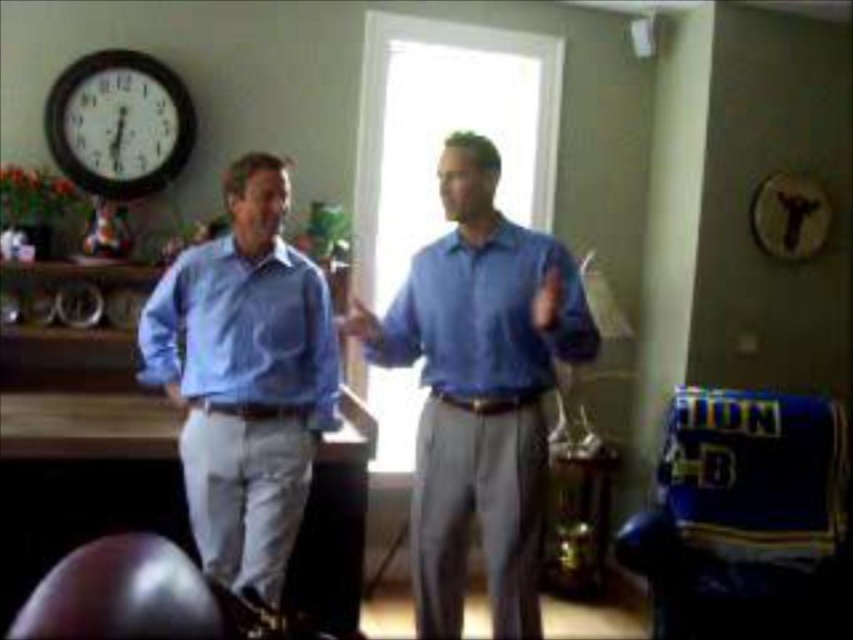
Question: Which point is closer to the camera?

Choices:
 (A) light blue cotton shirt at left
 (B) blue smooth shirt at center
 (C) matte blue shirt at left

Answer: (B)

Question: Which is farther from the wooden wall clock at upper left?

Choices:
 (A) matte blue shirt at left
 (B) blue smooth shirt at center
 (C) light blue cotton shirt at left
 (D) matte blue shirt at center

Answer: (B)

Question: Estimate the real-world distances between objects in this image. Which object is closer to the wooden wall clock at upper left?

Choices:
 (A) blue smooth shirt at center
 (B) matte blue shirt at center

Answer: (B)

Question: In this image, where is blue smooth shirt at center located relative to wooden wall clock at upper left?

Choices:
 (A) left
 (B) right

Answer: (B)

Question: Can you confirm if matte blue shirt at center is smaller than wooden wall clock at upper left?

Choices:
 (A) no
 (B) yes

Answer: (A)

Question: Is blue smooth shirt at center wider than wooden wall clock at upper left?

Choices:
 (A) yes
 (B) no

Answer: (A)